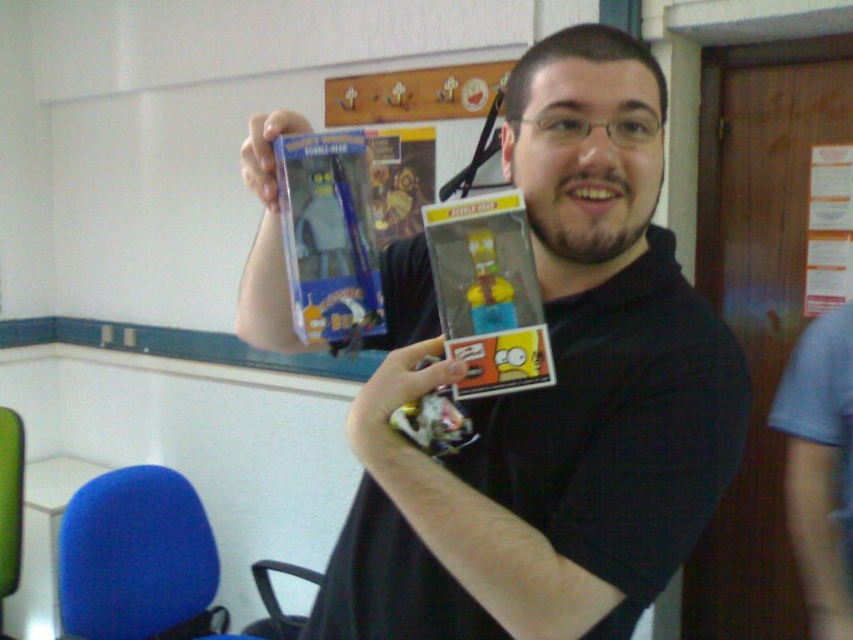
You are organizing a display for a toy store and need to know which of the two figures is wider to place them appropriately. Which one is wider between the matte black figure at center and the matte plastic toy at upper center?

The matte black figure at center is wider than the matte plastic toy at upper center, so it should be placed in a spot that accommodates its larger width.